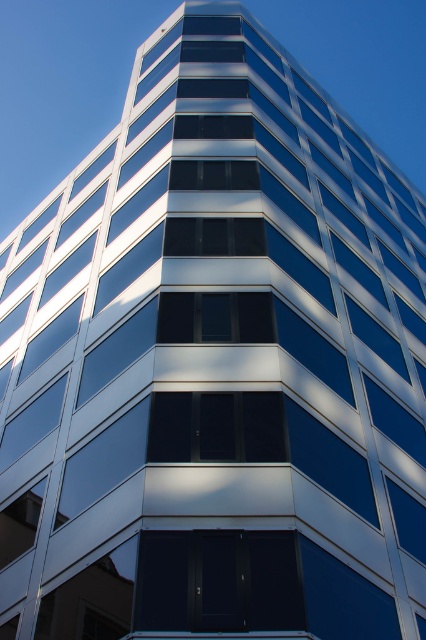
You are standing in front of a modern building with a sleek, geometric design. The building has rectangular windows arranged in a grid pattern. The upper windows are smaller and dark, while the lower ones are larger and similarly dark. The exterior is a mix of reflective glass and metallic panels. You notice a point at coordinates (218, 580). What object is located at that point?

The dark glass door at center is located at point (218, 580).

You are an architect reviewing the building design. You need to install a new security camera. The camera must be placed above the dark glass door at center but below the black glass window at center. Is this possible?

The dark glass door at center is positioned under the black glass window at center, so there is space between them where the camera can be installed above the dark glass door at center and below the black glass window at center.

You are a delivery person trying to enter the building. You see the dark glass door at center and the black glass window at center. Which one should you approach to enter the building?

The dark glass door at center is the entrance, so you should approach the dark glass door at center to enter the building.